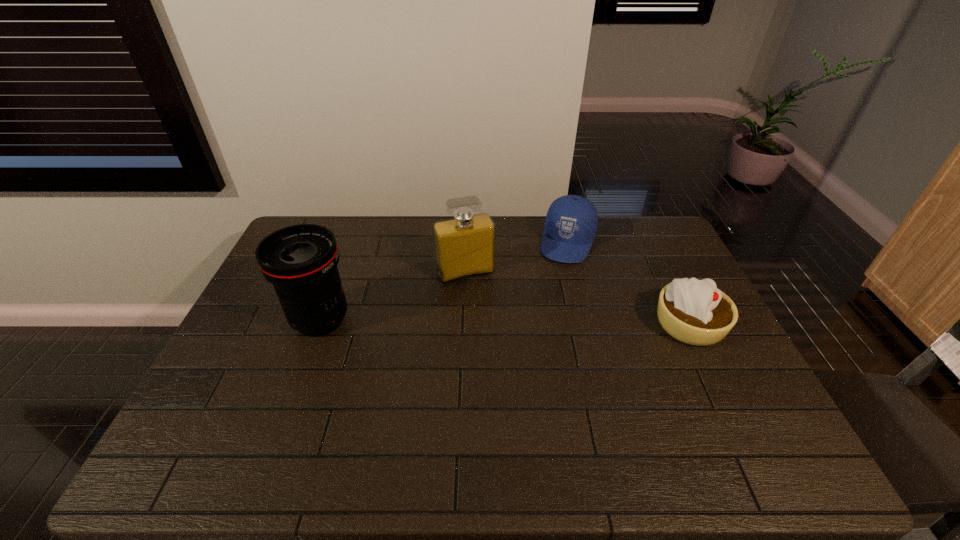
Where is `vacant region between the telephoto lens and the perfume`? The image size is (960, 540). vacant region between the telephoto lens and the perfume is located at coordinates (393, 296).

Image resolution: width=960 pixels, height=540 pixels. In order to click on empty space between the cap and the second object from left to right in this screenshot , I will do `click(516, 258)`.

The image size is (960, 540). I want to click on vacant area that lies between the whipped cream and the third object from left to right, so click(x=629, y=284).

Locate an element on the screen. vacant space that is in between the second object from right to left and the perfume is located at coordinates (516, 258).

Locate an element on the screen. Image resolution: width=960 pixels, height=540 pixels. vacant area that lies between the second object from right to left and the third object from right to left is located at coordinates (516, 258).

Where is `unoccupied area between the second object from right to left and the rightmost object`? This screenshot has width=960, height=540. unoccupied area between the second object from right to left and the rightmost object is located at coordinates (629, 284).

Locate an element on the screen. Image resolution: width=960 pixels, height=540 pixels. free space that is in between the whipped cream and the second object from left to right is located at coordinates (577, 299).

At what (x,y) coordinates should I click in order to perform the action: click on free spot between the whipped cream and the third object from right to left. Please return your answer as a coordinate pair (x, y). This screenshot has width=960, height=540. Looking at the image, I should click on (577, 299).

The width and height of the screenshot is (960, 540). Find the location of `vacant area that lies between the cap and the whipped cream`. vacant area that lies between the cap and the whipped cream is located at coordinates (629, 284).

This screenshot has height=540, width=960. Identify the location of the third closest object to the telephoto lens. (695, 312).